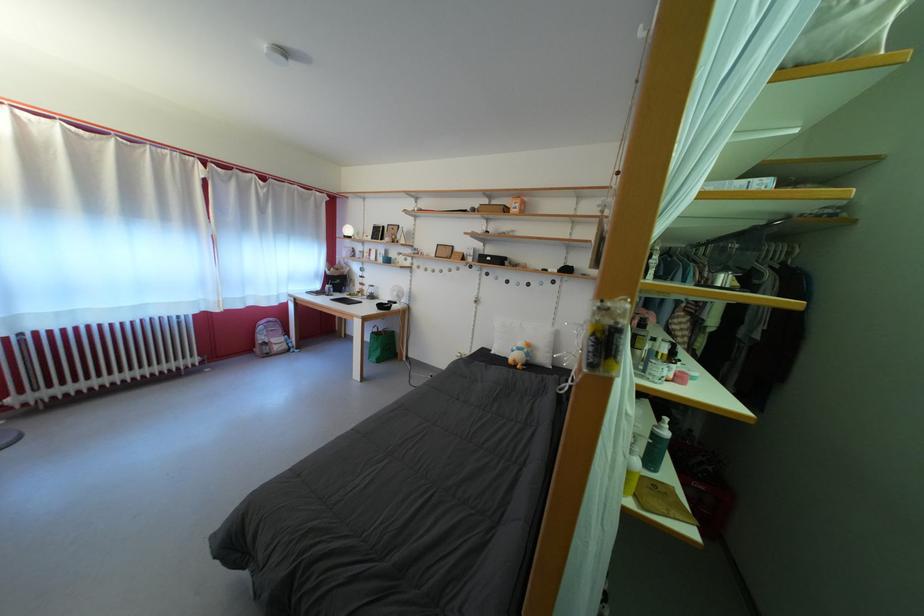
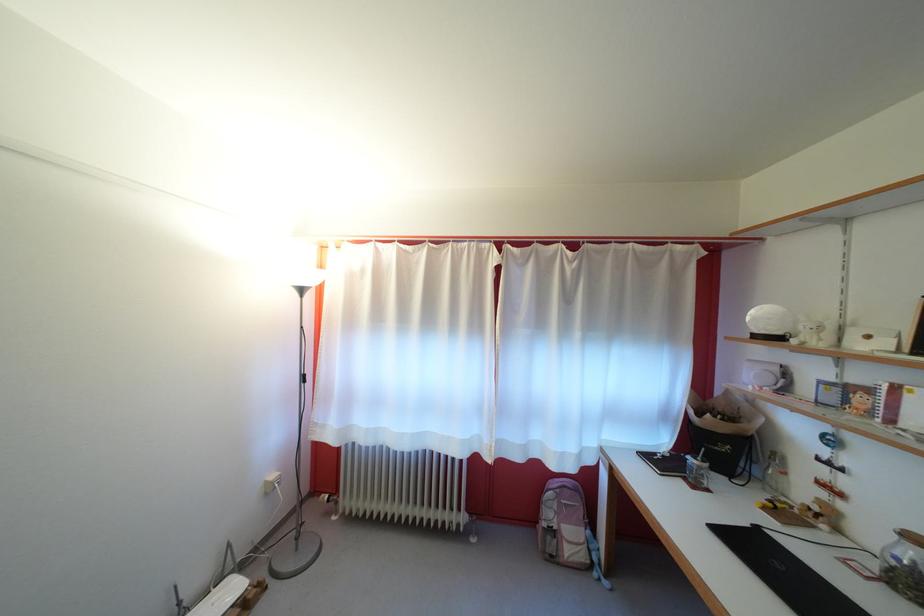
Find the pixel in the second image that matches (271,344) in the first image.

(556, 521)